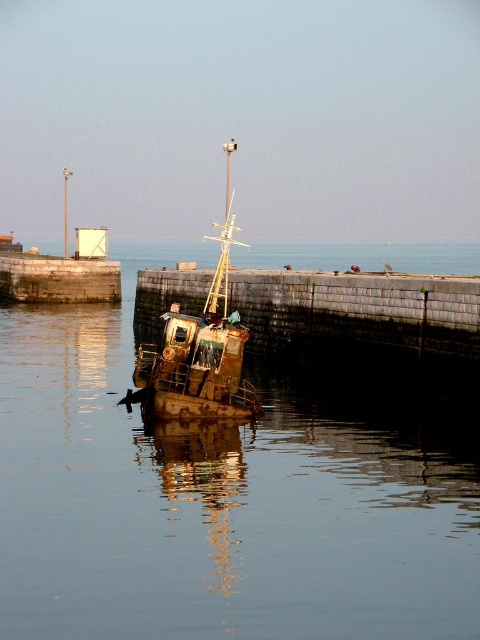
Based on the photo, you are a photographer planning to capture the rusty metal boat at center in the harbor scene. Since you want to include as much of the boat as possible in your shot, should you position yourself closer to the boat or farther away? Explain your reasoning based on the size relationship between the smooth water at center and the boat.

The smooth water at center is larger in size than the rusty metal boat at center. To include more of the boat in your shot, you should position yourself closer to the boat. This will help magnify the boat relative to the water, allowing it to take up more space in the frame.